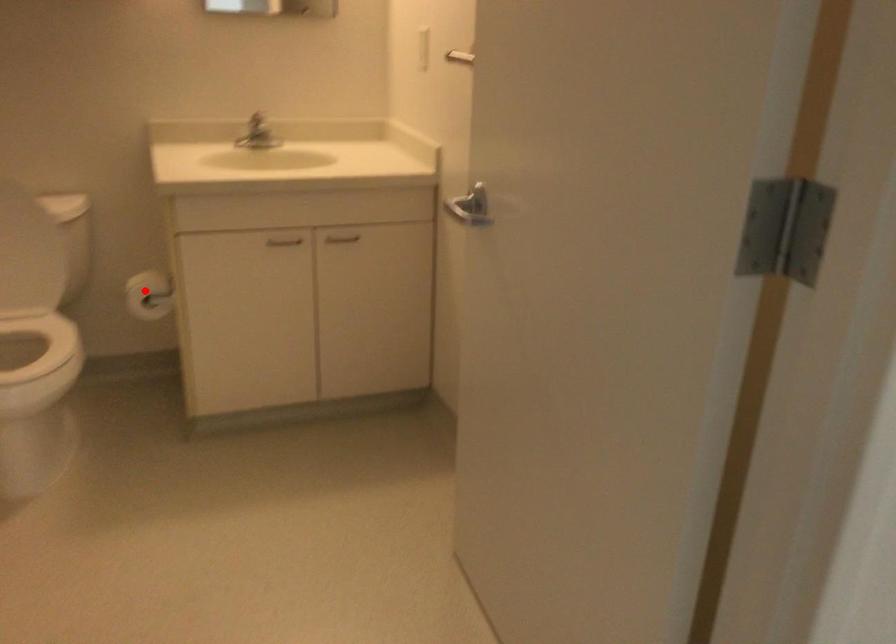
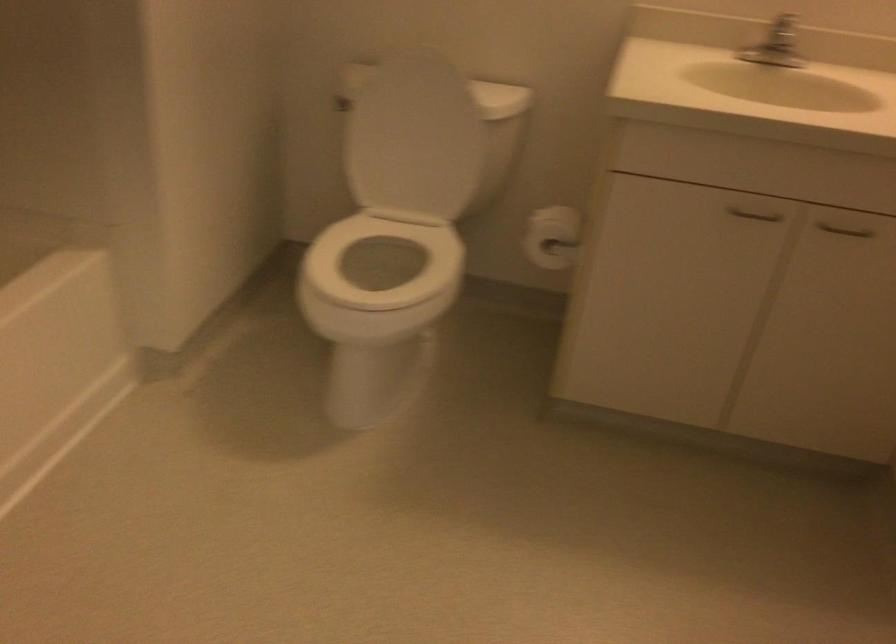
Question: I am providing you with two images of the same scene from different viewpoints. Image1 has a red point marked. In image2, the corresponding 3D location appears at what relative position? Reply with the corresponding letter.

Choices:
 (A) Closer
 (B) Farther

Answer: (A)